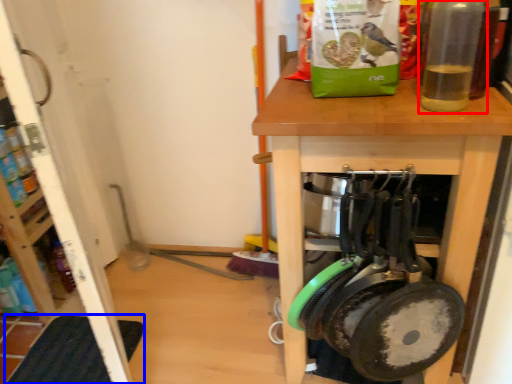
Question: Among these objects, which one is nearest to the camera, bottle (highlighted by a red box) or mat (highlighted by a blue box)?

Choices:
 (A) bottle
 (B) mat

Answer: (A)